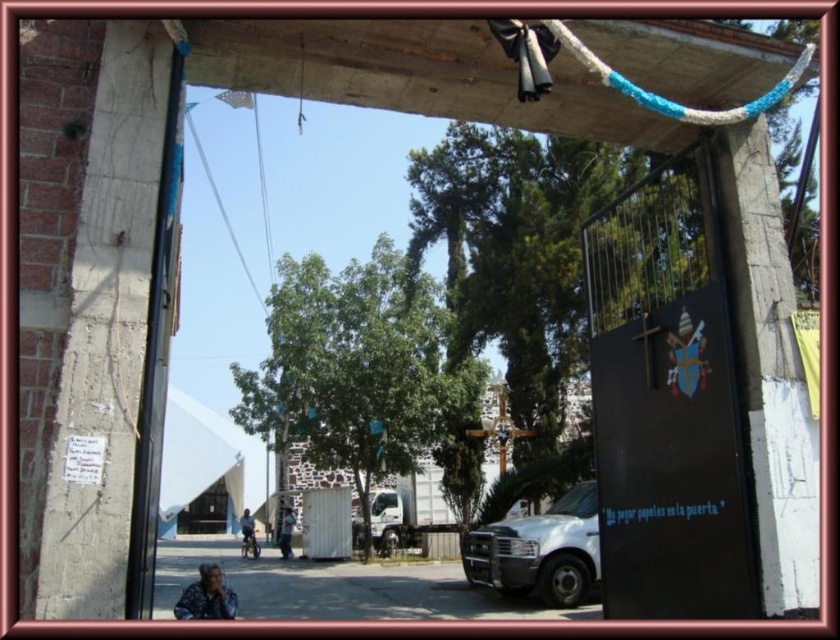
You are standing in the doorway looking out. You want to walk towards the white matte van at lower right and the blue braided rope at upper center. Which object will you reach first?

The white matte van at lower right is closer to you than the blue braided rope at upper center, so you will reach the white matte van at lower right first.

You are standing at the doorway looking out. There is a white matte van at lower right and a blue braided rope at upper center. Which object is positioned to the right of the other?

The white matte van at lower right is positioned to the right of the blue braided rope at upper center.

You are a delivery driver who needs to park your 2.5 meter tall truck in this area. Looking at the scene through the doorway, can you determine if the white matte van at lower right is taller than the blue braided rope at upper center?

The white matte van at lower right is taller than the blue braided rope at upper center, so yes, the van is taller than the rope.